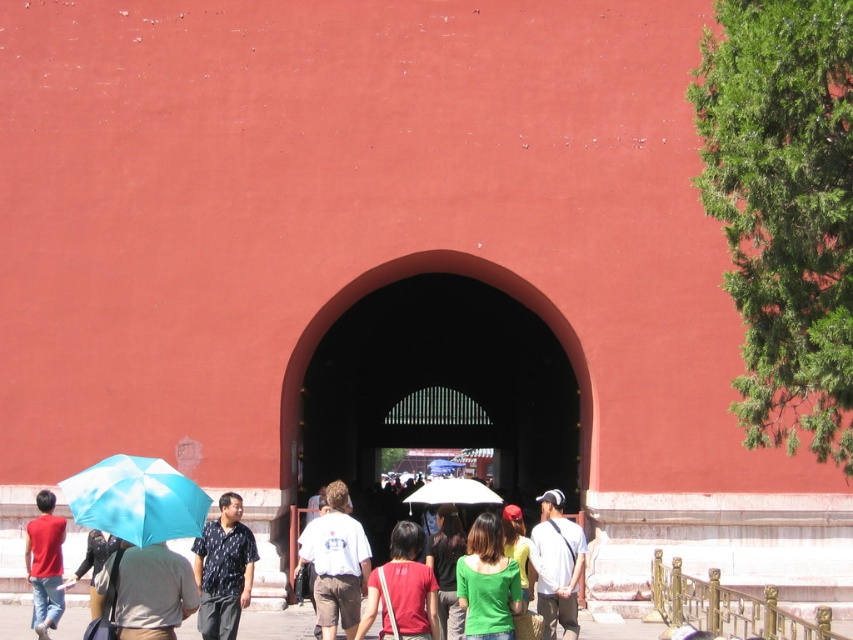
You are a photographer standing on the pathway in front of the historical site. You want to take a photo that includes both the matte red shirt at center and the green fabric shirt at center. Which shirt will appear bigger in the photo?

The matte red shirt at center will appear bigger in the photo because it has a larger size compared to the green fabric shirt at center.

You are standing on the pathway in front of the historical site and notice two umbrellas. Which one is more to the left, the blue matte umbrella at lower left or the matte blue umbrella at lower left?

The matte blue umbrella at lower left is more to the left because the blue matte umbrella at lower left is positioned on its right side.